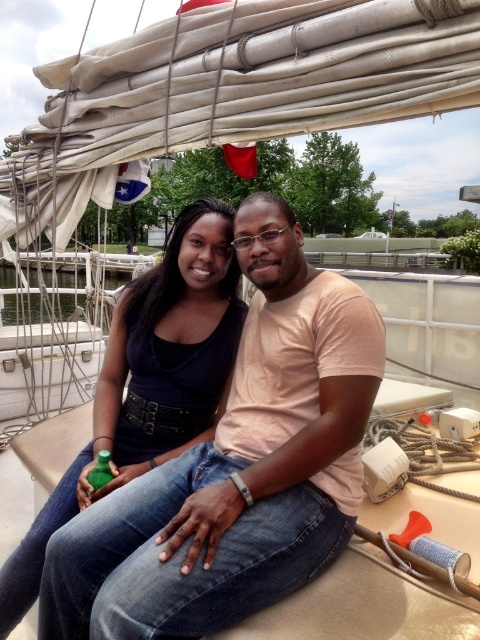
Question: Which point is farther to the camera?

Choices:
 (A) pos(167,269)
 (B) pos(97,465)

Answer: (A)

Question: Is matte black tank top at center wider than green matte bottle at lower left?

Choices:
 (A) yes
 (B) no

Answer: (A)

Question: Can you confirm if matte black tank top at center is wider than green matte bottle at lower left?

Choices:
 (A) no
 (B) yes

Answer: (B)

Question: Is matte black tank top at center to the left of green matte bottle at lower left from the viewer's perspective?

Choices:
 (A) no
 (B) yes

Answer: (A)